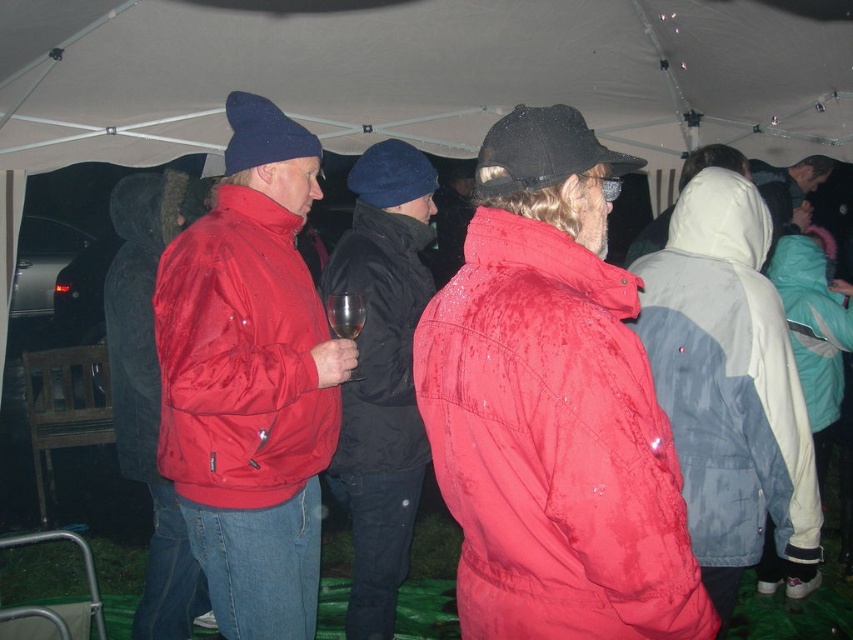
Question: Among these points, which one is farthest from the camera?

Choices:
 (A) pos(190,472)
 (B) pos(357,326)
 (C) pos(540,257)

Answer: (B)

Question: Does gray/white textured jacket at center have a smaller size compared to shiny red jacket at center?

Choices:
 (A) no
 (B) yes

Answer: (B)

Question: Can you confirm if gray/white textured jacket at center is bigger than clear glass wine glass at center?

Choices:
 (A) yes
 (B) no

Answer: (A)

Question: Among these points, which one is nearest to the camera?

Choices:
 (A) (410, 244)
 (B) (140, 310)

Answer: (B)

Question: Does matte red jacket at center have a larger size compared to shiny red jacket at center?

Choices:
 (A) no
 (B) yes

Answer: (A)

Question: Which object appears closest to the camera in this image?

Choices:
 (A) matte red jacket at center
 (B) clear glass wine glass at center

Answer: (A)